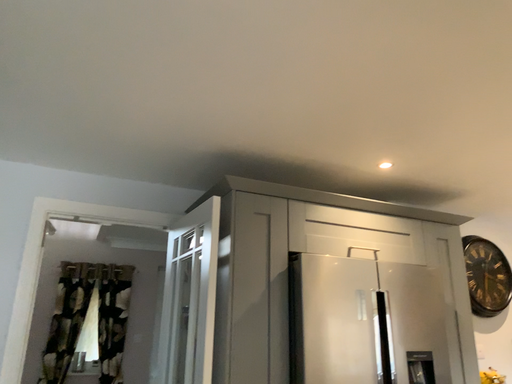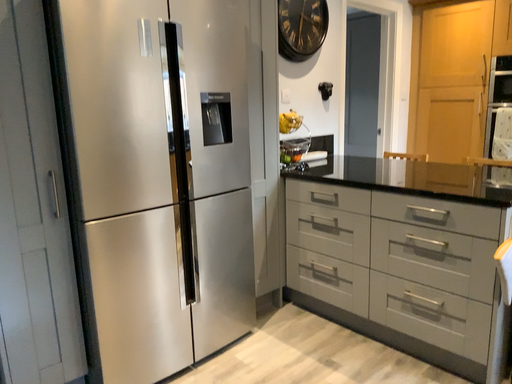
Question: How did the camera likely rotate when shooting the video?

Choices:
 (A) rotated upward
 (B) rotated downward

Answer: (B)